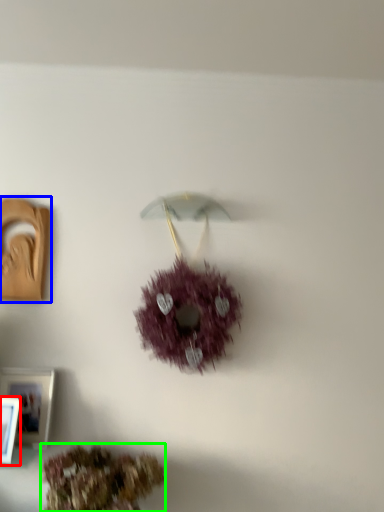
Question: Based on their relative distances, which object is nearer to picture frame (highlighted by a red box)? Choose from picture frame (highlighted by a blue box) and flower (highlighted by a green box).

Choices:
 (A) picture frame
 (B) flower

Answer: (B)